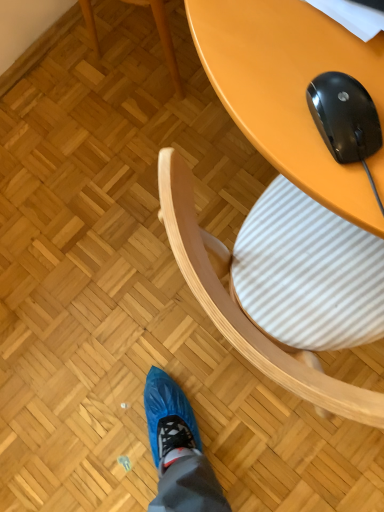
You are a GUI agent. You are given a task and a screenshot of the screen. Output one action in this format:
    pyautogui.click(x=<x>, y=<y>)
    Task: Click on the vacant space behind black glossy mouse at upper right
    
    Given the screenshot: What is the action you would take?
    pyautogui.click(x=288, y=48)